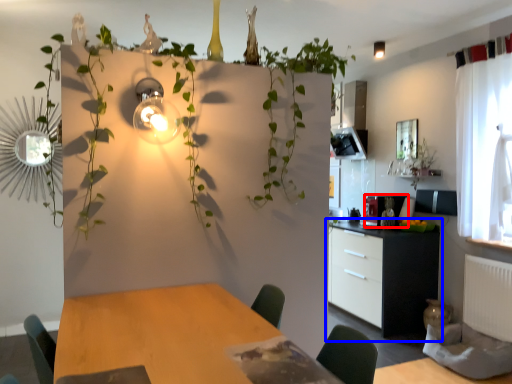
Question: Among these objects, which one is nearest to the camera, appliance (highlighted by a red box) or cabinetry (highlighted by a blue box)?

Choices:
 (A) appliance
 (B) cabinetry

Answer: (B)